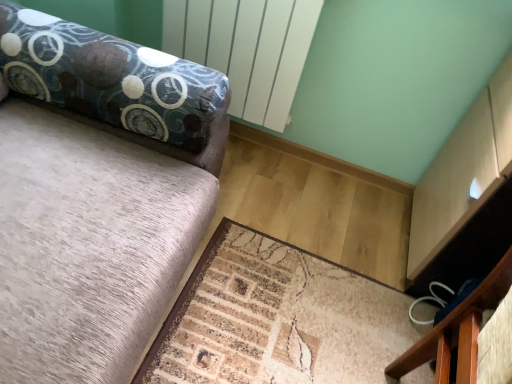
What do you see at coordinates (276, 319) in the screenshot? This screenshot has height=384, width=512. I see `beige textured mat at lower center` at bounding box center [276, 319].

I want to click on beige textured mat at lower center, so click(x=276, y=319).

What is the approximate width of beige textured mat at lower center?

It is 35.29 inches.

This screenshot has height=384, width=512. Describe the element at coordinates (457, 332) in the screenshot. I see `black fabric drawer at lower right` at that location.

In order to face black fabric drawer at lower right, should I rotate leftwards or rightwards?

Rotate your view right by about 24.816°.

The width and height of the screenshot is (512, 384). In order to click on black fabric drawer at lower right in this screenshot , I will do [x=457, y=332].

This screenshot has height=384, width=512. Find the location of `beige textured mat at lower center`. beige textured mat at lower center is located at coordinates (276, 319).

Does beige textured mat at lower center appear on the right side of black fabric drawer at lower right?

In fact, beige textured mat at lower center is to the left of black fabric drawer at lower right.

Based on the photo, in the image, is beige textured mat at lower center positioned in front of or behind black fabric drawer at lower right?

In the image, beige textured mat at lower center appears in front of black fabric drawer at lower right.

Considering the points (302, 307) and (471, 351), which point is behind, point (302, 307) or point (471, 351)?

Point (302, 307)

From the image's perspective, between beige textured mat at lower center and black fabric drawer at lower right, which one is located above?

beige textured mat at lower center, from the image's perspective.

From a real-world perspective, is beige textured mat at lower center above or below black fabric drawer at lower right?

In terms of real-world spatial position, beige textured mat at lower center is below black fabric drawer at lower right.

Can you confirm if beige textured mat at lower center is thinner than black fabric drawer at lower right?

No, beige textured mat at lower center is not thinner than black fabric drawer at lower right.

Considering the relative sizes of beige textured mat at lower center and black fabric drawer at lower right in the image provided, is beige textured mat at lower center shorter than black fabric drawer at lower right?

Yes, beige textured mat at lower center is shorter than black fabric drawer at lower right.

Is beige textured mat at lower center smaller than black fabric drawer at lower right?

Incorrect, beige textured mat at lower center is not smaller in size than black fabric drawer at lower right.

Do you think beige textured mat at lower center is within black fabric drawer at lower right, or outside of it?

The correct answer is: outside.

Is beige textured mat at lower center positioned far away from black fabric drawer at lower right?

They are positioned close to each other.

Is beige textured mat at lower center facing towards black fabric drawer at lower right?

No, beige textured mat at lower center is not oriented towards black fabric drawer at lower right.

Where is `mat lying in front of the black fabric drawer at lower right`? The height and width of the screenshot is (384, 512). mat lying in front of the black fabric drawer at lower right is located at coordinates (276, 319).

Can you confirm if black fabric drawer at lower right is positioned to the right of beige textured mat at lower center?

Indeed, black fabric drawer at lower right is positioned on the right side of beige textured mat at lower center.

Relative to beige textured mat at lower center, is black fabric drawer at lower right in front or behind?

Clearly, black fabric drawer at lower right is behind beige textured mat at lower center.

Does point (415, 355) lie behind point (282, 249)?

No, it is in front of (282, 249).

Looking at this image, from the image's perspective, is black fabric drawer at lower right on beige textured mat at lower center?

Incorrect, from the image's perspective, black fabric drawer at lower right is lower than beige textured mat at lower center.

In the scene shown: From a real-world perspective, does black fabric drawer at lower right stand above beige textured mat at lower center?

Indeed, from a real-world perspective, black fabric drawer at lower right stands above beige textured mat at lower center.

From the picture: Considering the sizes of objects black fabric drawer at lower right and beige textured mat at lower center in the image provided, who is thinner, black fabric drawer at lower right or beige textured mat at lower center?

black fabric drawer at lower right is thinner.

Which of these two, black fabric drawer at lower right or beige textured mat at lower center, stands shorter?

beige textured mat at lower center is shorter.

Based on the photo, which of these two, black fabric drawer at lower right or beige textured mat at lower center, is smaller?

black fabric drawer at lower right is smaller.

Would you say black fabric drawer at lower right is inside or outside beige textured mat at lower center?

black fabric drawer at lower right is not inside beige textured mat at lower center, it's outside.

Is black fabric drawer at lower right in contact with beige textured mat at lower center?

No, black fabric drawer at lower right is not next to beige textured mat at lower center.

Is black fabric drawer at lower right facing towards beige textured mat at lower center?

No.

How different are the orientations of black fabric drawer at lower right and beige textured mat at lower center in degrees?

The angular difference between black fabric drawer at lower right and beige textured mat at lower center is 176 degrees.

Locate an element on the screen. The width and height of the screenshot is (512, 384). mat in front of the black fabric drawer at lower right is located at coordinates (276, 319).

The width and height of the screenshot is (512, 384). I want to click on mat located above the black fabric drawer at lower right (from the image's perspective), so click(x=276, y=319).

Identify the location of mat on the left of black fabric drawer at lower right. This screenshot has width=512, height=384. (276, 319).